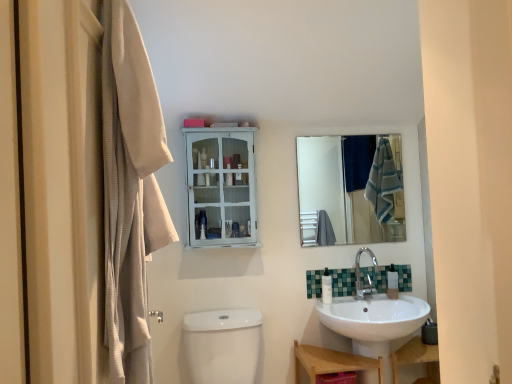
Where is `free location to the left of white glossy soap dispenser at lower right, which is the 1th toiletry from right to left`? free location to the left of white glossy soap dispenser at lower right, which is the 1th toiletry from right to left is located at coordinates (370, 297).